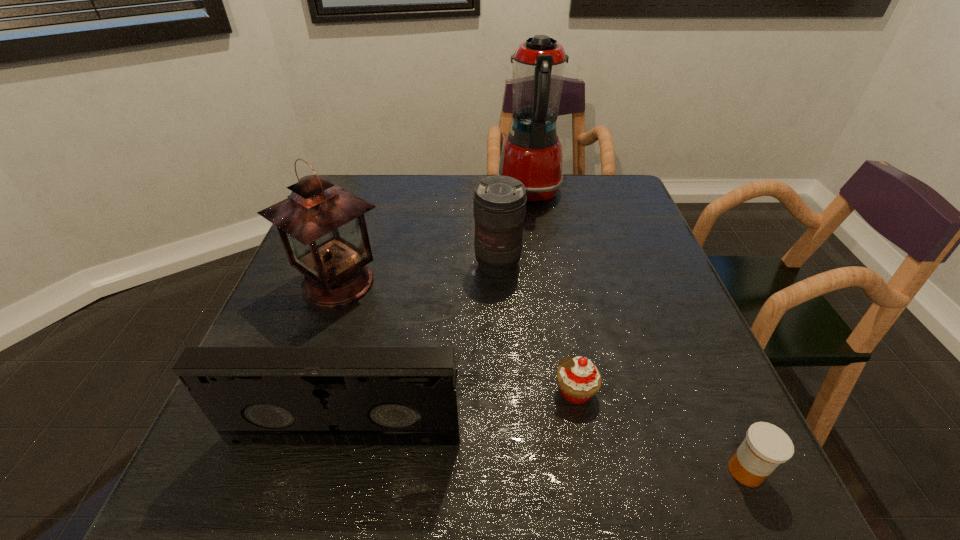
Where is `object situated at the near right corner`? The width and height of the screenshot is (960, 540). object situated at the near right corner is located at coordinates (766, 446).

Locate an element on the screen. Image resolution: width=960 pixels, height=540 pixels. free spot at the far edge of the desktop is located at coordinates (388, 213).

You are a GUI agent. You are given a task and a screenshot of the screen. Output one action in this format:
    pyautogui.click(x=<x>, y=<y>)
    Task: Click on the vacant area at the near edge of the desktop
    This screenshot has width=960, height=540.
    Given the screenshot: What is the action you would take?
    pyautogui.click(x=499, y=489)

The width and height of the screenshot is (960, 540). I want to click on vacant point at the left edge, so click(x=271, y=310).

The height and width of the screenshot is (540, 960). I want to click on free spot at the right edge of the desktop, so click(613, 240).

This screenshot has height=540, width=960. What are the coordinates of `vacant area at the far left corner of the desktop` in the screenshot? It's located at (375, 214).

Image resolution: width=960 pixels, height=540 pixels. In order to click on vacant area at the near left corner of the desktop in this screenshot , I will do [265, 490].

At what (x,y) coordinates should I click in order to perform the action: click on free space at the far right corner of the desktop. Please return your answer as a coordinate pair (x, y). Image resolution: width=960 pixels, height=540 pixels. Looking at the image, I should click on (598, 196).

What are the coordinates of `vacant space that's between the fifth shortest object and the telephoto lens` in the screenshot? It's located at (418, 274).

In order to click on vacant space that is in between the food processor and the fifth farthest object in this screenshot , I will do `click(438, 314)`.